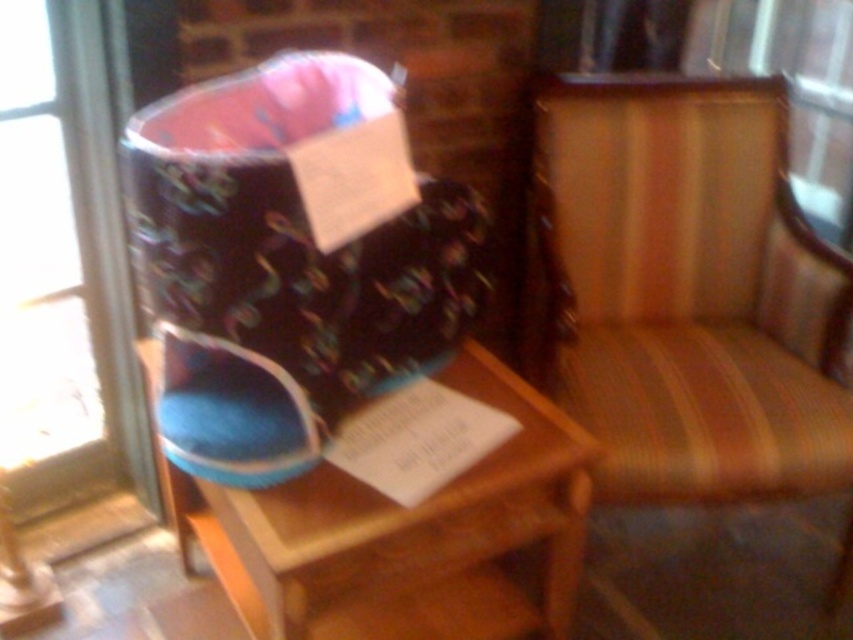
Question: Is striped fabric armchair at center to the left of blue fabric stool at center from the viewer's perspective?

Choices:
 (A) yes
 (B) no

Answer: (B)

Question: Which of these objects is positioned closest to the velvet fabric boot at center?

Choices:
 (A) blue fabric stool at center
 (B) striped fabric armchair at center

Answer: (A)

Question: Which point appears farthest from the camera in this image?

Choices:
 (A) (631, 112)
 (B) (265, 444)

Answer: (A)

Question: Can you confirm if striped fabric armchair at center is positioned to the left of blue fabric stool at center?

Choices:
 (A) no
 (B) yes

Answer: (A)

Question: In this image, where is velvet fabric boot at center located relative to blue fabric stool at center?

Choices:
 (A) below
 (B) above

Answer: (B)

Question: Based on their relative distances, which object is nearer to the velvet fabric boot at center?

Choices:
 (A) blue fabric stool at center
 (B) striped fabric armchair at center

Answer: (A)